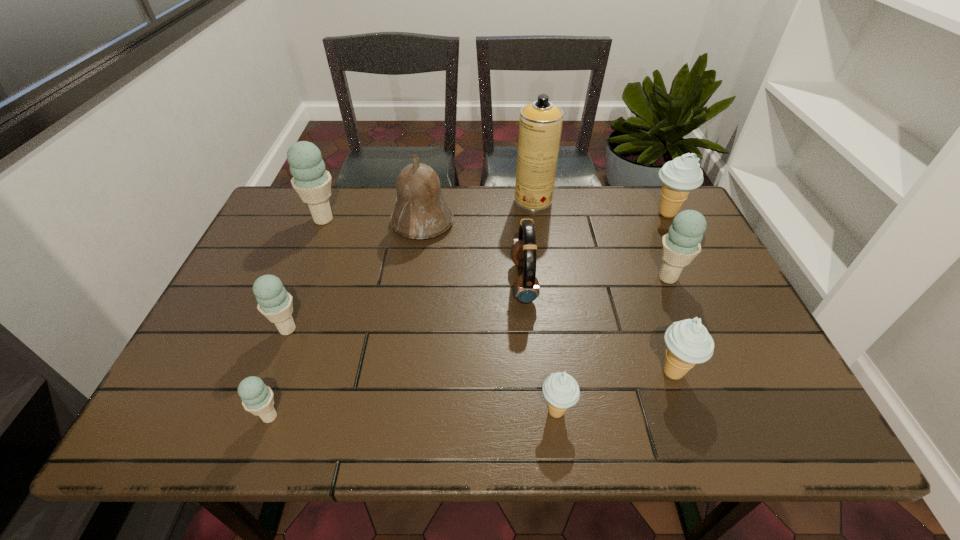
Identify which beige icecream is the second closest to the second beige icecream from right to left. Please provide its 2D coordinates. Your answer should be formatted as a tuple, i.e. [(x, y)], where the tuple contains the x and y coordinates of a point satisfying the conditions above.

[(679, 176)]

Locate which beige icecream ranks second in proximity to the leftmost beige icecream. Please provide its 2D coordinates. Your answer should be formatted as a tuple, i.e. [(x, y)], where the tuple contains the x and y coordinates of a point satisfying the conditions above.

[(679, 176)]

Find the location of a particular element. This screenshot has width=960, height=540. free space that satisfies the following two spatial constraints: 1. on the front side of the tallest object; 2. on the left side of the third nearest object is located at coordinates (558, 372).